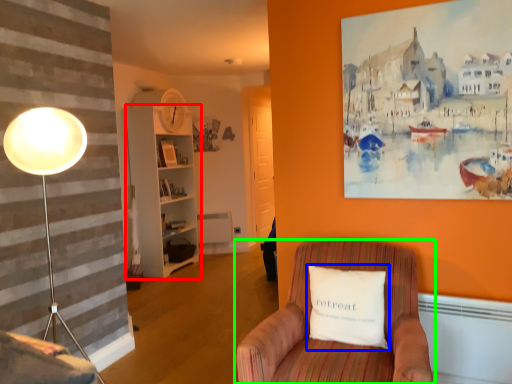
Question: Estimate the real-world distances between objects in this image. Which object is closer to bookshelf (highlighted by a red box), pillow (highlighted by a blue box) or chair (highlighted by a green box)?

Choices:
 (A) pillow
 (B) chair

Answer: (B)